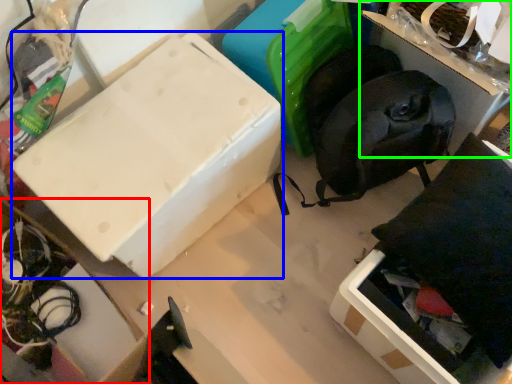
Question: Considering the real-world distances, which object is closest to cardboard box (highlighted by a red box)? box (highlighted by a blue box) or storage box (highlighted by a green box).

Choices:
 (A) box
 (B) storage box

Answer: (A)